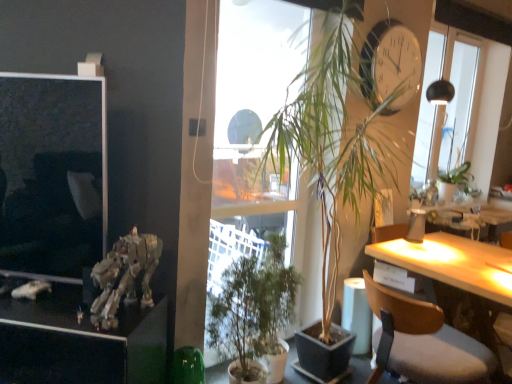
Question: Choose the correct answer: Is metallic silver robot at left inside wooden chair at right or outside it?

Choices:
 (A) inside
 (B) outside

Answer: (B)

Question: In terms of width, does metallic silver robot at left look wider or thinner when compared to wooden chair at right?

Choices:
 (A) thin
 (B) wide

Answer: (A)

Question: Which is nearer to the metallic gold skeleton at lower left?

Choices:
 (A) green matte plant at center, which ranks as the 1th houseplant in bottom-to-top order
 (B) green leafy plant at upper right
 (C) white glossy clock at upper right
 (D) transparent glass window at upper right
 (E) wooden chair at right

Answer: (A)

Question: Based on their relative distances, which object is nearer to the white glossy clock at upper right?

Choices:
 (A) green matte plant at center, arranged as the second houseplant when ordered from the bottom
 (B) wooden chair at right
 (C) green leafy plant at upper right
 (D) green matte plant at center, placed as the second houseplant when sorted from top to bottom
 (E) transparent glass window at upper right

Answer: (A)